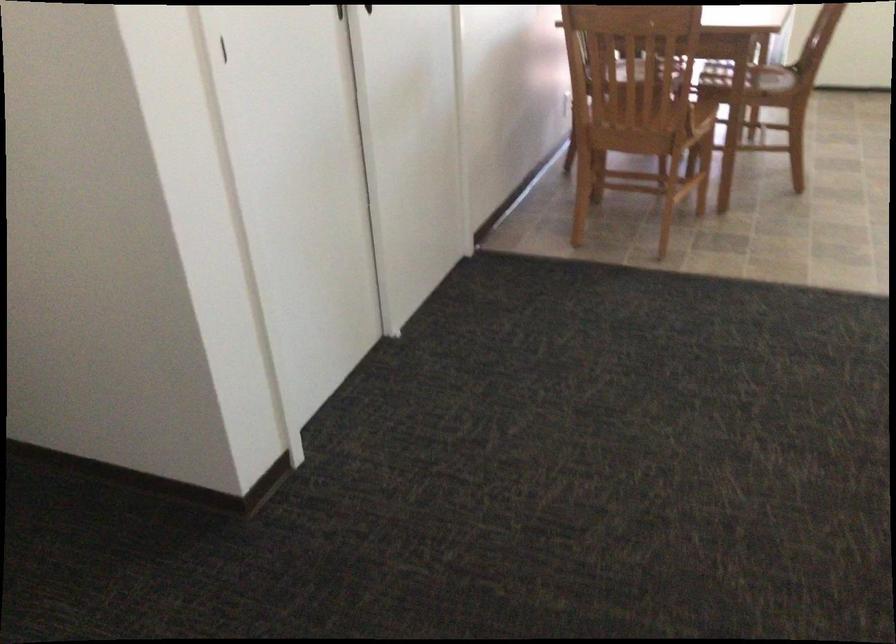
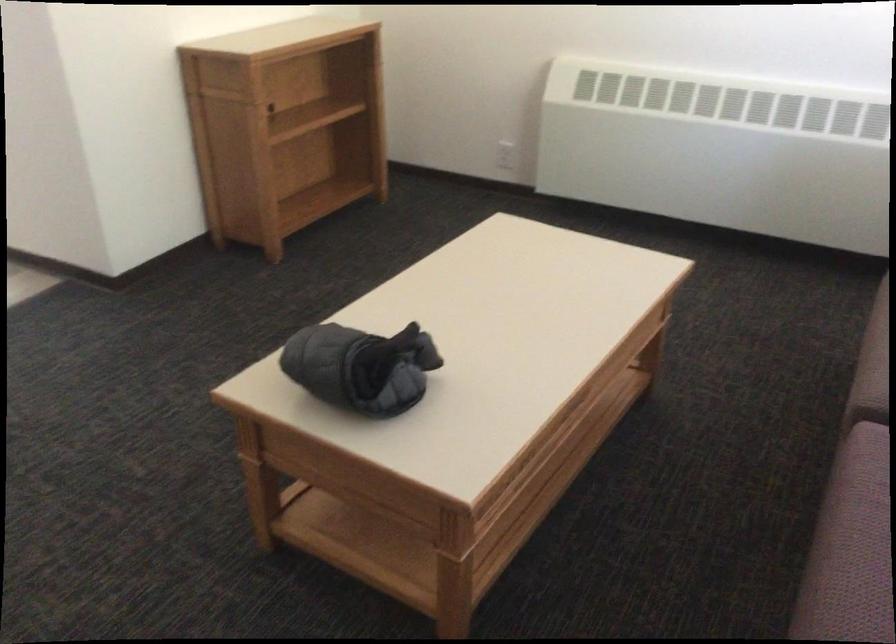
How did the camera likely rotate?

The rotation direction of the camera is right-down.